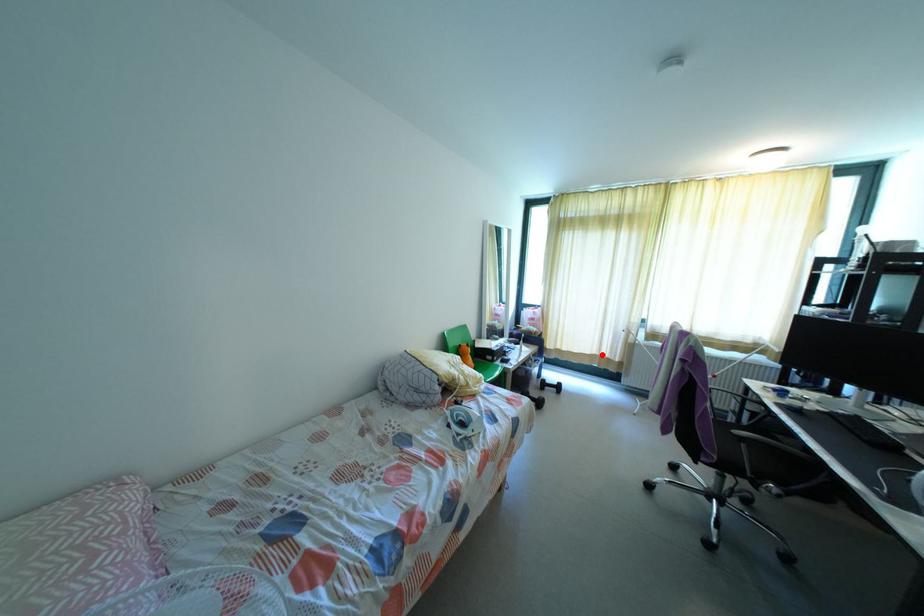
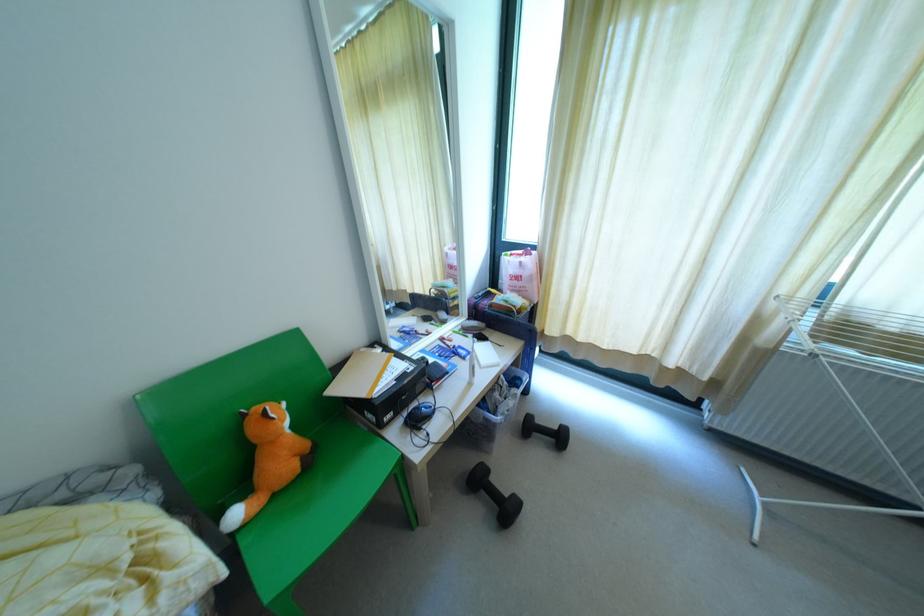
The point at the highlighted location is marked in the first image. Where is the corresponding point in the second image?

(670, 363)